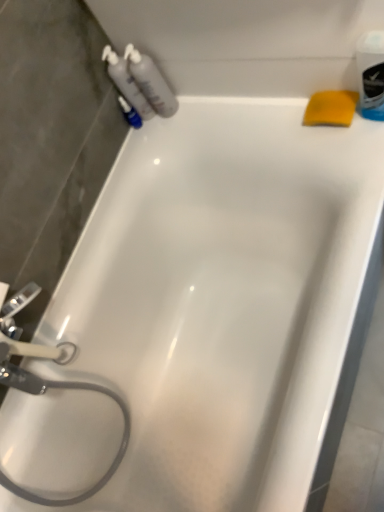
Question: Is yellow sponge at upper right smaller than translucent plastic bottles at upper left, which is the 2th cleaning product in right-to-left order?

Choices:
 (A) no
 (B) yes

Answer: (B)

Question: From the image's perspective, is yellow sponge at upper right above translucent plastic bottles at upper left, which is counted as the 1th cleaning product, starting from the left?

Choices:
 (A) yes
 (B) no

Answer: (B)

Question: Is yellow sponge at upper right turned away from translucent plastic bottles at upper left, which is counted as the 1th cleaning product, starting from the left?

Choices:
 (A) yes
 (B) no

Answer: (B)

Question: Does yellow sponge at upper right have a lesser width compared to translucent plastic bottles at upper left, which is counted as the 1th cleaning product, starting from the left?

Choices:
 (A) yes
 (B) no

Answer: (B)

Question: From a real-world perspective, is yellow sponge at upper right physically above translucent plastic bottles at upper left, which is the 2th cleaning product in right-to-left order?

Choices:
 (A) yes
 (B) no

Answer: (B)

Question: Considering the positions of point (165, 82) and point (342, 105), is point (165, 82) closer or farther from the camera than point (342, 105)?

Choices:
 (A) farther
 (B) closer

Answer: (A)

Question: Considering the positions of translucent plastic bottles at upper left, positioned as the first cleaning product in right-to-left order, and yellow sponge at upper right in the image, is translucent plastic bottles at upper left, positioned as the first cleaning product in right-to-left order, bigger or smaller than yellow sponge at upper right?

Choices:
 (A) small
 (B) big

Answer: (B)

Question: Is translucent plastic bottles at upper left, positioned as the first cleaning product in right-to-left order, to the left or to the right of yellow sponge at upper right in the image?

Choices:
 (A) left
 (B) right

Answer: (A)

Question: From a real-world perspective, relative to yellow sponge at upper right, is translucent plastic bottles at upper left, positioned as the first cleaning product in right-to-left order, vertically above or below?

Choices:
 (A) below
 (B) above

Answer: (B)

Question: In terms of size, does translucent plastic bottles at upper left, positioned as the first cleaning product in right-to-left order, appear bigger or smaller than blue plastic mouthwash at upper right?

Choices:
 (A) big
 (B) small

Answer: (A)

Question: In the image, is translucent plastic bottles at upper left, positioned as the first cleaning product in right-to-left order, positioned in front of or behind blue plastic mouthwash at upper right?

Choices:
 (A) front
 (B) behind

Answer: (B)

Question: From a real-world perspective, relative to blue plastic mouthwash at upper right, is translucent plastic bottles at upper left, positioned as the first cleaning product in right-to-left order, vertically above or below?

Choices:
 (A) below
 (B) above

Answer: (B)

Question: Is translucent plastic bottles at upper left, positioned as the first cleaning product in right-to-left order, to the left or to the right of blue plastic mouthwash at upper right in the image?

Choices:
 (A) left
 (B) right

Answer: (A)

Question: From the image's perspective, relative to translucent plastic bottles at upper left, positioned as the first cleaning product in right-to-left order, is translucent plastic bottles at upper left, which is counted as the 1th cleaning product, starting from the left, above or below?

Choices:
 (A) above
 (B) below

Answer: (A)

Question: Choose the correct answer: Is translucent plastic bottles at upper left, which is the 2th cleaning product in right-to-left order, inside translucent plastic bottles at upper left, positioned as the first cleaning product in right-to-left order, or outside it?

Choices:
 (A) inside
 (B) outside

Answer: (B)